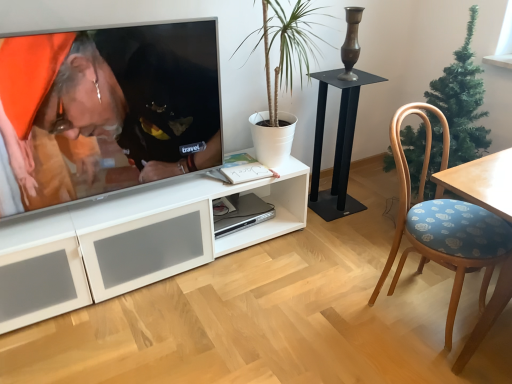
Question: Looking at their shapes, would you say matte black shirt at upper left is wider or thinner than white matte plant at center?

Choices:
 (A) thin
 (B) wide

Answer: (A)

Question: From a real-world perspective, is matte black shirt at upper left above or below white matte plant at center?

Choices:
 (A) below
 (B) above

Answer: (A)

Question: Which object is positioned closest to the green artificial christmas tree at right?

Choices:
 (A) matte black shirt at upper left
 (B) wooden chair with blue floral cushion at right
 (C) sleek silver computer at center
 (D) black metal table at center
 (E) white matte plant at center

Answer: (B)

Question: Estimate the real-world distances between objects in this image. Which object is farther from the matte black shirt at upper left?

Choices:
 (A) wooden chair with blue floral cushion at right
 (B) black metal table at center
 (C) white matte plant at center
 (D) sleek silver computer at center
 (E) green artificial christmas tree at right

Answer: (E)